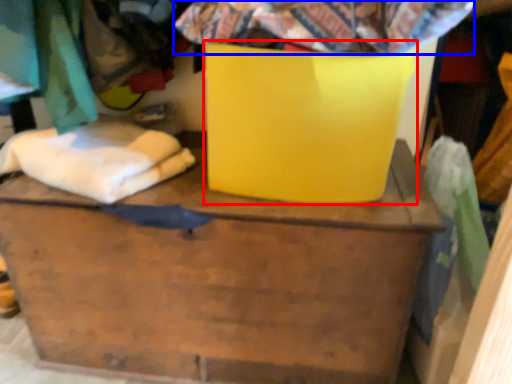
Question: Which of the following is the closest to the observer, cardboard box (highlighted by a red box) or fabric (highlighted by a blue box)?

Choices:
 (A) cardboard box
 (B) fabric

Answer: (B)